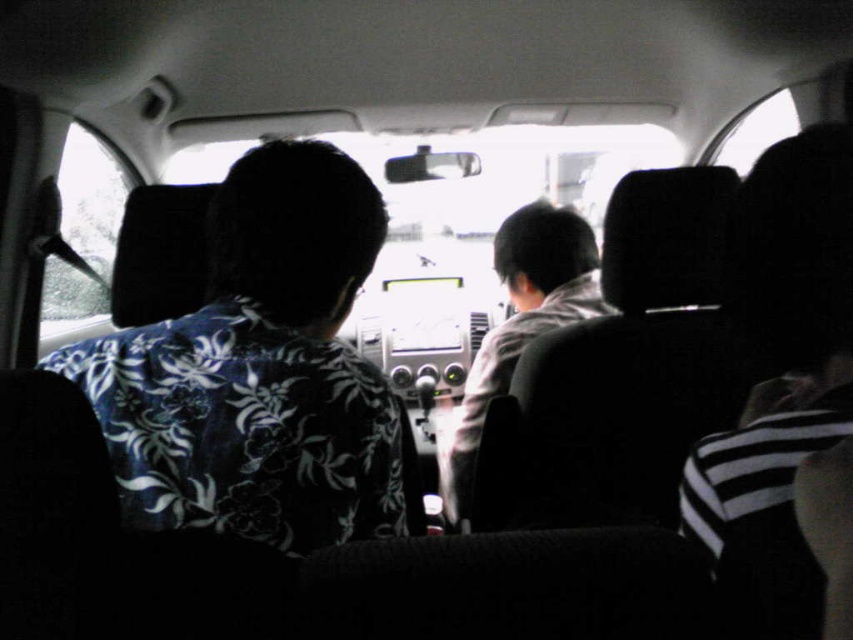
Question: Can you confirm if floral-patterned shirt at left is thinner than gray hoodie at center?

Choices:
 (A) no
 (B) yes

Answer: (A)

Question: Which of the following is the farthest from the observer?

Choices:
 (A) gray hoodie at center
 (B) floral-patterned shirt at left

Answer: (A)

Question: In this image, where is floral-patterned shirt at left located relative to gray hoodie at center?

Choices:
 (A) right
 (B) left

Answer: (B)

Question: Can you confirm if floral-patterned shirt at left is wider than gray hoodie at center?

Choices:
 (A) yes
 (B) no

Answer: (A)